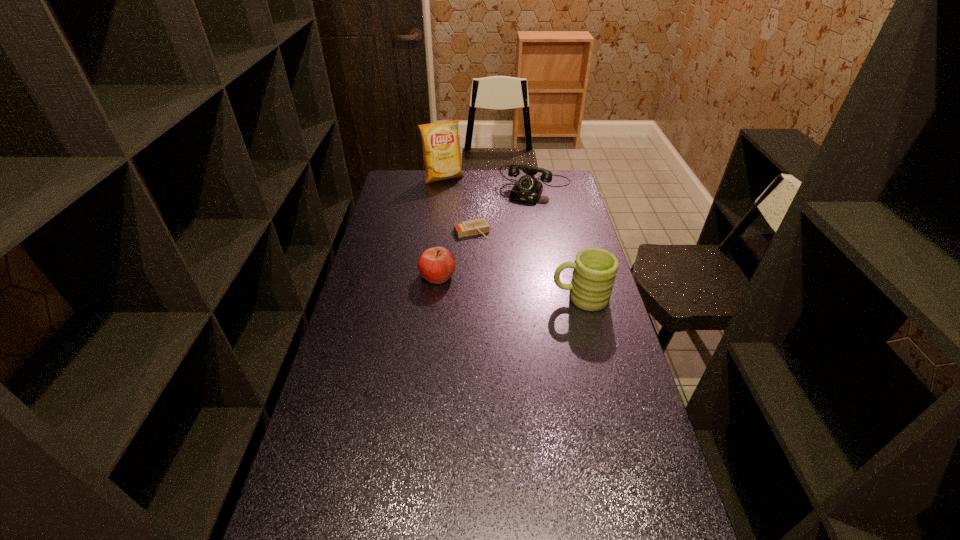
The image size is (960, 540). Find the location of `apple`. apple is located at coordinates (437, 264).

Where is `mug`? This screenshot has width=960, height=540. mug is located at coordinates (595, 269).

Identify the location of the third nearest object. (477, 226).

Locate an element on the screen. Image resolution: width=960 pixels, height=540 pixels. matchbox is located at coordinates (477, 226).

Where is `crisp (potato chip)`? This screenshot has height=540, width=960. crisp (potato chip) is located at coordinates (441, 150).

At what (x,y) coordinates should I click in order to perform the action: click on telephone. Please return your answer as a coordinate pair (x, y). Looking at the image, I should click on pyautogui.click(x=527, y=189).

At what (x,y) coordinates should I click in order to perform the action: click on vacant region located on the front of the apple. Please return your answer as a coordinate pair (x, y). Image resolution: width=960 pixels, height=540 pixels. Looking at the image, I should click on (431, 334).

What are the coordinates of `free spot located 0.140m on the side of the fourth shortest object with the handle` in the screenshot? It's located at (511, 298).

The height and width of the screenshot is (540, 960). What are the coordinates of `free space located 0.130m on the side of the fourth shortest object with the handle` in the screenshot? It's located at (514, 298).

Locate an element on the screen. This screenshot has height=540, width=960. free space located on the side of the fourth shortest object with the handle is located at coordinates (445, 298).